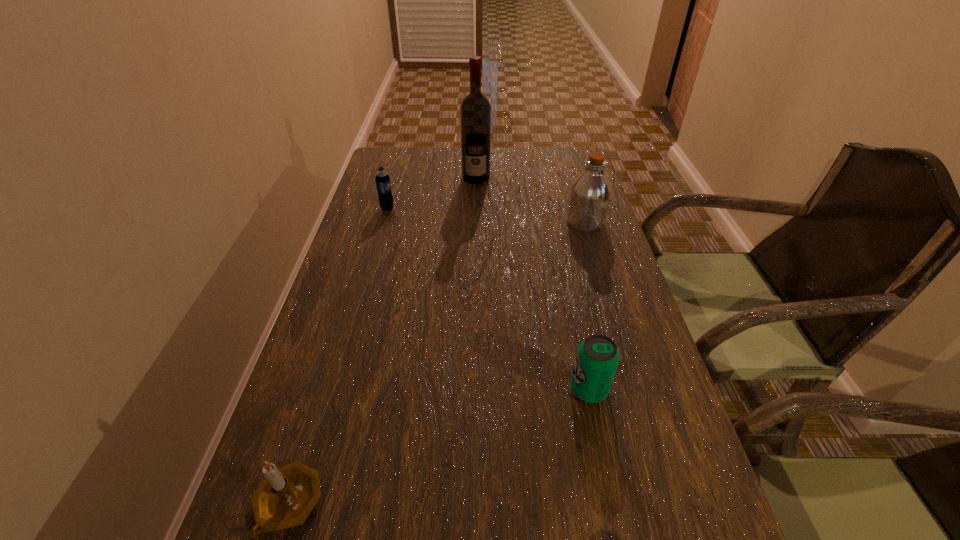
The image size is (960, 540). In order to click on object that is the third closest to the farther pop soda in this screenshot , I will do `click(597, 358)`.

Where is `the closest pop soda to the nearest object`? the closest pop soda to the nearest object is located at coordinates (597, 358).